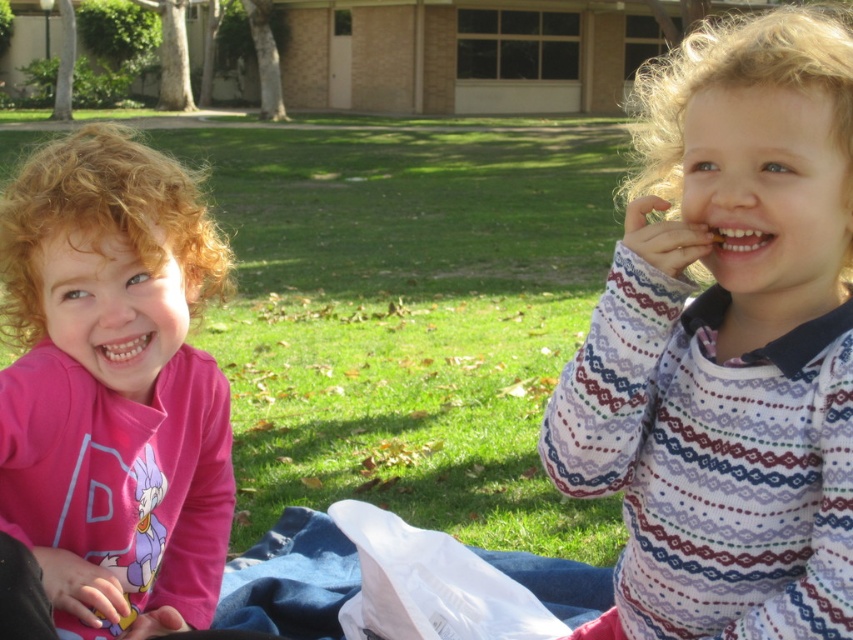
Between white knit sweater at right and pink matte shirt at left, which one has less height?

white knit sweater at right

From the picture: How far apart are white knit sweater at right and pink matte shirt at left?

white knit sweater at right is 4.09 feet from pink matte shirt at left.

Does point (698, 336) come farther from viewer compared to point (109, 184)?

That is False.

The width and height of the screenshot is (853, 640). I want to click on white knit sweater at right, so click(727, 344).